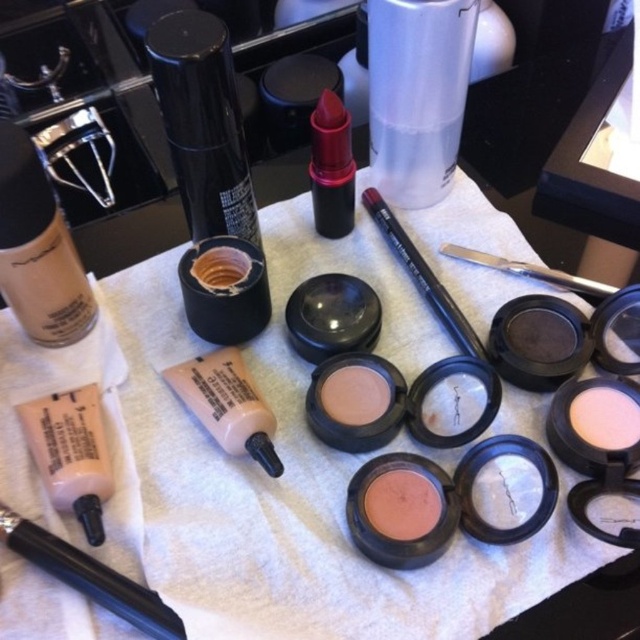
Consider the image. You are a makeup artist preparing a kit. You have a black matte pen at center and a matte cream eyeshadow at center. Which item is taller?

The black matte pen at center is taller than the matte cream eyeshadow at center.

You are taking a photo of the makeup setup and want to focus on the two points labeled as point (216, 420) and point (524, 330). Which point should you focus on first to ensure the closer one is sharp?

You should focus on point (216, 420) first because it is closer to the camera than point (524, 330), ensuring the closer one is sharp.